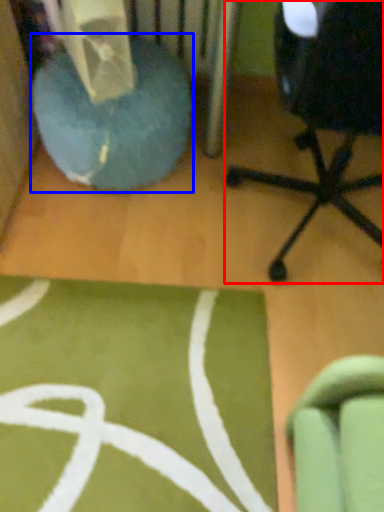
Question: Which object is closer to the camera taking this photo, chair (highlighted by a red box) or bean bag chair (highlighted by a blue box)?

Choices:
 (A) chair
 (B) bean bag chair

Answer: (A)